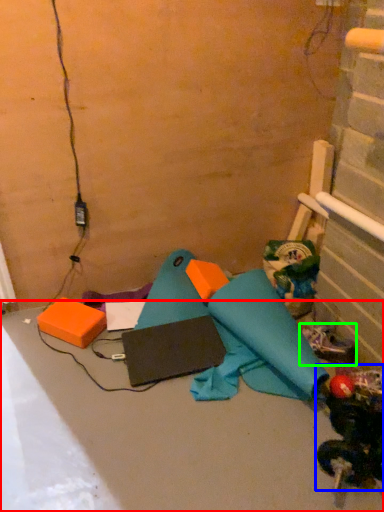
Question: Based on their relative distances, which object is farther from concrete (highlighted by a red box)? Choose from toy (highlighted by a blue box) and footwear (highlighted by a green box).

Choices:
 (A) toy
 (B) footwear

Answer: (B)